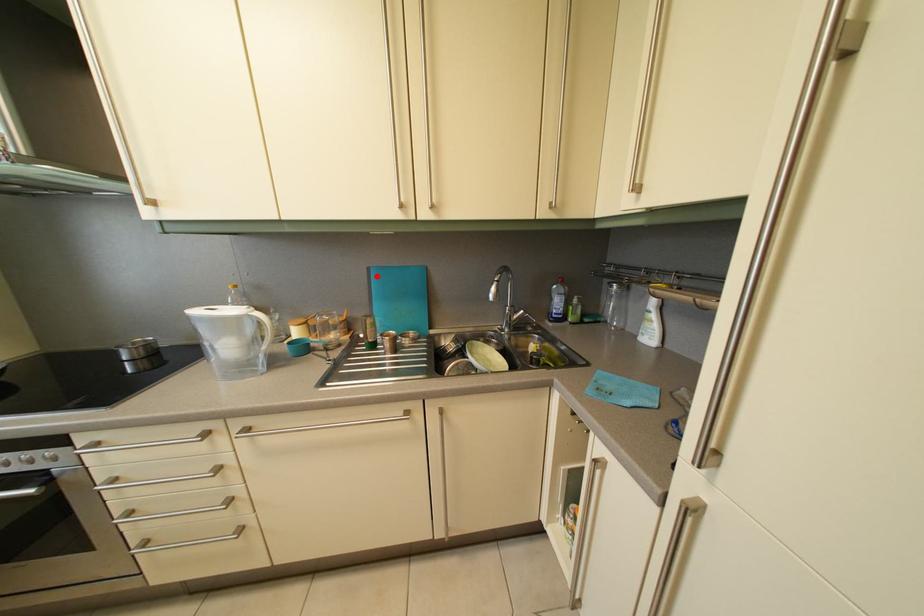
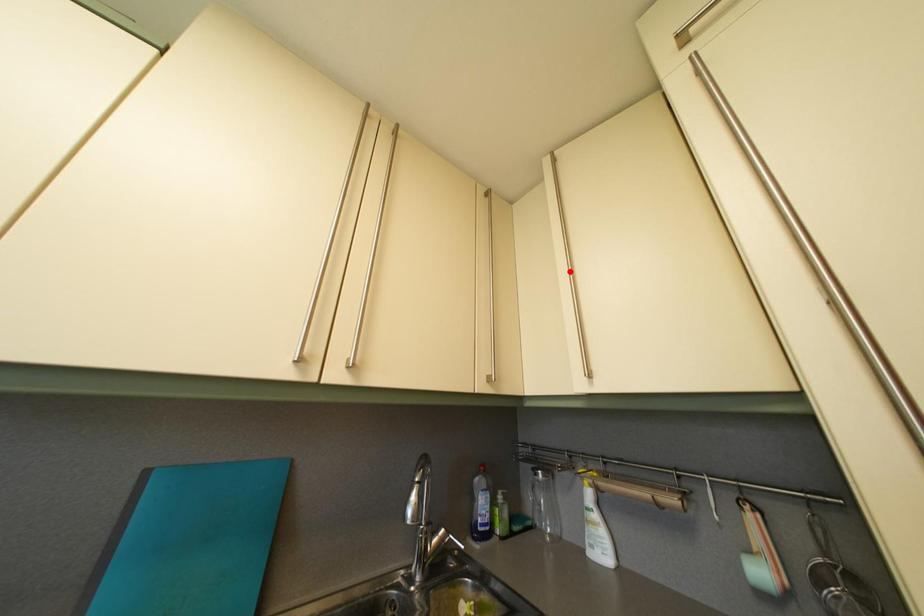
I am providing you with two images of the same scene from different viewpoints. A red point is marked on the first image and another point is marked on the second image. Do the highlighted points in image1 and image2 indicate the same real-world spot?

No